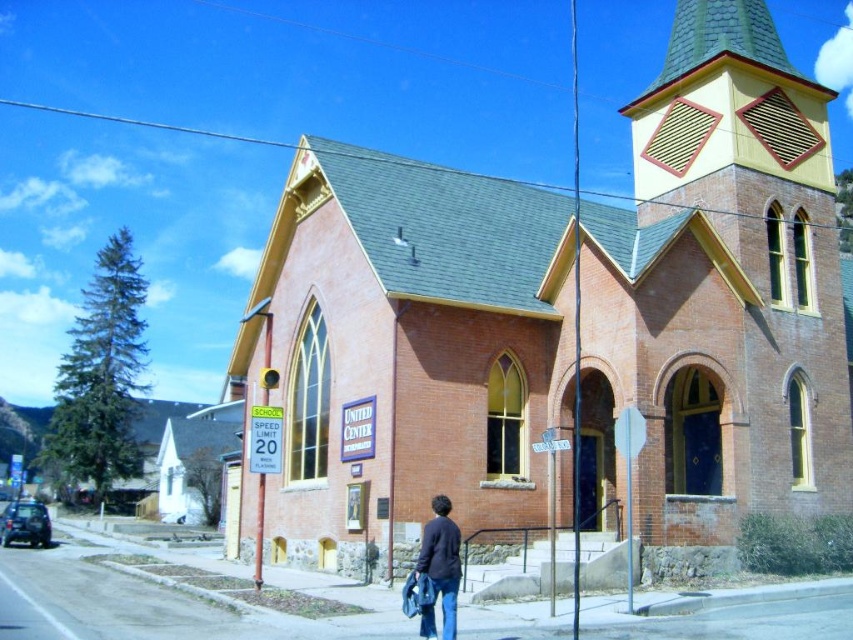
Question: Is red brick church at center wider than dark blue sweater at lower center?

Choices:
 (A) no
 (B) yes

Answer: (B)

Question: Is red brick church at center thinner than dark blue sweater at lower center?

Choices:
 (A) no
 (B) yes

Answer: (A)

Question: Where is red brick church at center located in relation to dark blue sweater at lower center in the image?

Choices:
 (A) right
 (B) left

Answer: (A)

Question: Which object is closer to the camera taking this photo?

Choices:
 (A) red brick church at center
 (B) dark blue sweater at lower center

Answer: (B)